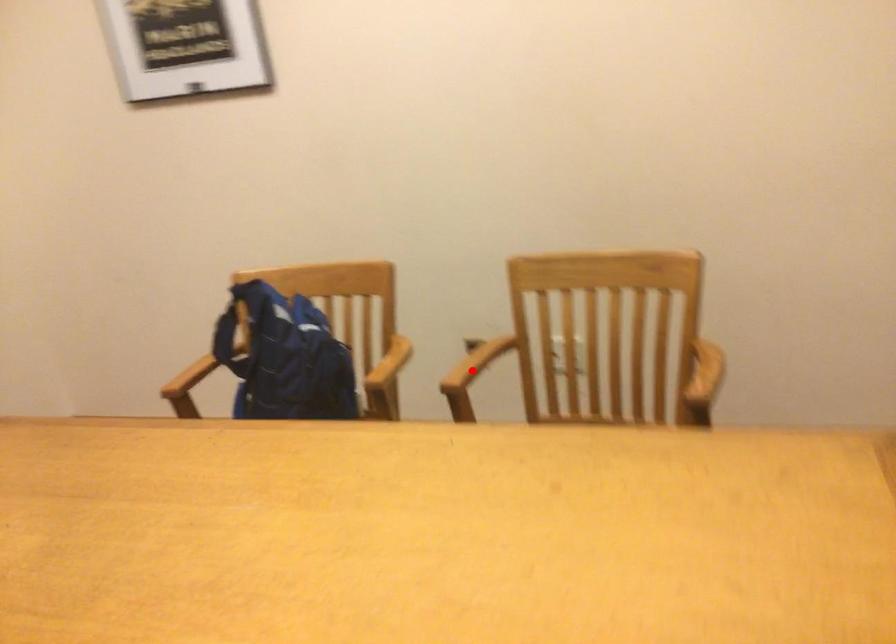
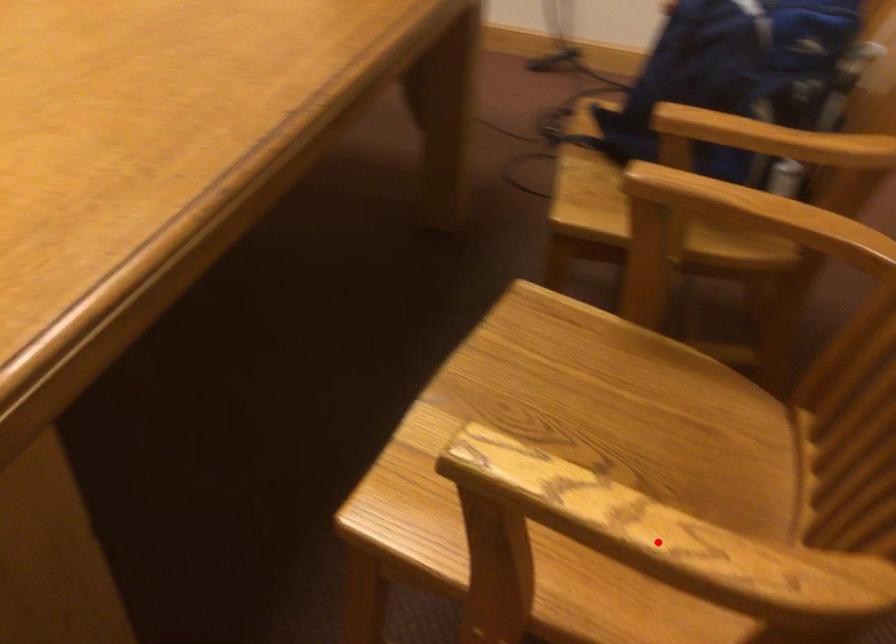
I am providing you with two images of the same scene from different viewpoints. A red point is marked on the first image and another point is marked on the second image. Are the points marked in image1 and image2 representing the same 3D position?

No